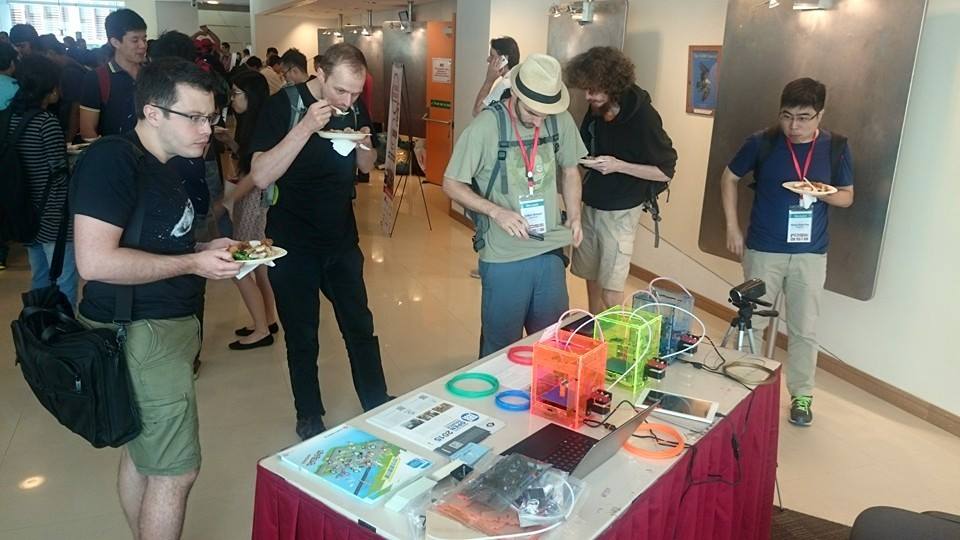
Identify the location of paper plate of food. (255, 252), (348, 131), (806, 181).